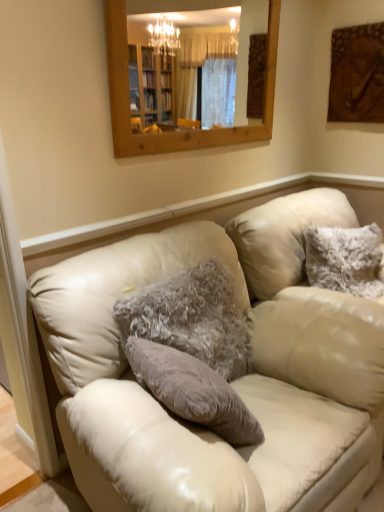
Question: Is fuzzy white pillow at upper right, the 1th pillow positioned from the back, to the left of fuzzy gray pillow at center, which is counted as the first pillow, starting from the left, from the viewer's perspective?

Choices:
 (A) yes
 (B) no

Answer: (B)

Question: Would you say fuzzy gray pillow at center, which is counted as the 1th pillow, starting from the front, is part of fuzzy white pillow at upper right, the 1th pillow positioned from the back,'s contents?

Choices:
 (A) no
 (B) yes

Answer: (A)

Question: From a real-world perspective, is fuzzy white pillow at upper right, the 1th pillow positioned from the back, physically above fuzzy gray pillow at center, which is counted as the 1th pillow, starting from the front?

Choices:
 (A) yes
 (B) no

Answer: (A)

Question: Considering the relative positions of fuzzy white pillow at upper right, the 1th pillow positioned from the back, and fuzzy gray pillow at center, the 2th pillow when ordered from back to front, in the image provided, is fuzzy white pillow at upper right, the 1th pillow positioned from the back, in front of fuzzy gray pillow at center, the 2th pillow when ordered from back to front,?

Choices:
 (A) no
 (B) yes

Answer: (A)

Question: Are fuzzy white pillow at upper right, acting as the 2th pillow starting from the left, and fuzzy gray pillow at center, which is counted as the first pillow, starting from the left, located far from each other?

Choices:
 (A) no
 (B) yes

Answer: (A)

Question: Is fuzzy white pillow at upper right, positioned as the 1th pillow in right-to-left order, next to fuzzy gray pillow at center, which is the 2th pillow from right to left?

Choices:
 (A) no
 (B) yes

Answer: (A)

Question: Considering the relative positions of wooden frame mirror at upper center and fuzzy gray pillow at center, which is counted as the 1th pillow, starting from the front, in the image provided, is wooden frame mirror at upper center to the right of fuzzy gray pillow at center, which is counted as the 1th pillow, starting from the front, from the viewer's perspective?

Choices:
 (A) yes
 (B) no

Answer: (A)

Question: Does wooden frame mirror at upper center have a smaller size compared to fuzzy gray pillow at center, the 2th pillow when ordered from back to front?

Choices:
 (A) no
 (B) yes

Answer: (B)

Question: Is wooden frame mirror at upper center outside fuzzy gray pillow at center, the 2th pillow when ordered from back to front?

Choices:
 (A) yes
 (B) no

Answer: (A)

Question: Is wooden frame mirror at upper center closer to camera compared to fuzzy gray pillow at center, which is counted as the first pillow, starting from the left?

Choices:
 (A) yes
 (B) no

Answer: (B)

Question: Can you confirm if wooden frame mirror at upper center is wider than fuzzy gray pillow at center, which is counted as the 1th pillow, starting from the front?

Choices:
 (A) no
 (B) yes

Answer: (A)

Question: From the image's perspective, is wooden frame mirror at upper center on fuzzy gray pillow at center, which is counted as the 1th pillow, starting from the front?

Choices:
 (A) no
 (B) yes

Answer: (B)

Question: Is leather couch at center taller than wooden textured painting at upper right?

Choices:
 (A) no
 (B) yes

Answer: (B)